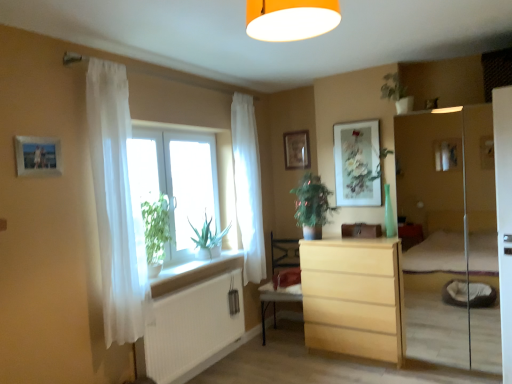
What do you see at coordinates (357, 163) in the screenshot? I see `matte floral artwork at upper center, which is counted as the first picture frame, starting from the right` at bounding box center [357, 163].

Locate an element on the screen. light wood chest of drawers at center is located at coordinates (353, 297).

Measure the distance between point [184,283] and camera.

A distance of 3.34 meters exists between point [184,283] and camera.

In order to click on green leafy plant at center in this screenshot , I will do pyautogui.click(x=312, y=206).

What do you see at coordinates (248, 186) in the screenshot? I see `white sheer curtain at window, which is the second curtain in left-to-right order` at bounding box center [248, 186].

This screenshot has width=512, height=384. Find the location of `matte floral artwork at upper center, which is counted as the first picture frame, starting from the right`. matte floral artwork at upper center, which is counted as the first picture frame, starting from the right is located at coordinates (357, 163).

In the scene shown: Would you consider wooden armchair at center to be distant from white sheer curtain at window, positioned as the first curtain in right-to-left order?

No, wooden armchair at center is not far from white sheer curtain at window, positioned as the first curtain in right-to-left order.

Is wooden armchair at center thinner than white sheer curtain at window, which is the first curtain in back-to-front order?

No, wooden armchair at center is not thinner than white sheer curtain at window, which is the first curtain in back-to-front order.

How different are the orientations of wooden armchair at center and white sheer curtain at window, positioned as the first curtain in right-to-left order, in degrees?

They differ by 74.2 degrees in their facing directions.

Considering the sizes of wooden armchair at center and white sheer curtain at window, positioned as the first curtain in right-to-left order, in the image, is wooden armchair at center taller or shorter than white sheer curtain at window, positioned as the first curtain in right-to-left order,?

In the image, wooden armchair at center appears to be shorter than white sheer curtain at window, positioned as the first curtain in right-to-left order.

Which of these two, matte floral artwork at upper center, the 2th picture frame viewed from the front, or white sheer curtain at window, acting as the 2th curtain starting from the front, is bigger?

Bigger between the two is white sheer curtain at window, acting as the 2th curtain starting from the front.

Which is behind, point (359, 149) or point (244, 130)?

Point (244, 130)

Which is in front, matte floral artwork at upper center, which is counted as the 2th picture frame, starting from the back, or white sheer curtain at window, acting as the 2th curtain starting from the front?

white sheer curtain at window, acting as the 2th curtain starting from the front.

Between matte floral artwork at upper center, which is counted as the 2th picture frame, starting from the back, and white sheer curtain at window, acting as the 2th curtain starting from the front, which one has less height?

With less height is matte floral artwork at upper center, which is counted as the 2th picture frame, starting from the back.

Is white sheer curtain at left, which appears as the 1th curtain when viewed from the left, thinner than light wood chest of drawers at center?

Yes, white sheer curtain at left, which appears as the 1th curtain when viewed from the left, is thinner than light wood chest of drawers at center.

From a real-world perspective, is white sheer curtain at left, the 2th curtain when ordered from back to front, under light wood chest of drawers at center?

Actually, white sheer curtain at left, the 2th curtain when ordered from back to front, is physically above light wood chest of drawers at center in the real world.

You are a GUI agent. You are given a task and a screenshot of the screen. Output one action in this format:
    pyautogui.click(x=<x>, y=<y>)
    Task: Click on the 2nd curtain positioned above the light wood chest of drawers at center (from a real-world perspective)
    
    Given the screenshot: What is the action you would take?
    pyautogui.click(x=116, y=205)

Is white sheer curtain at left, which is the second curtain from right to left, far from light wood chest of drawers at center?

That's right, there is a large distance between white sheer curtain at left, which is the second curtain from right to left, and light wood chest of drawers at center.

From a real-world perspective, is green matte plant at upper center above or below white ribbed radiator at lower left?

Clearly, from a real-world perspective, green matte plant at upper center is above white ribbed radiator at lower left.

At what (x,y) coordinates should I click in order to perform the action: click on plant above the white ribbed radiator at lower left (from a real-world perspective). Please return your answer as a coordinate pair (x, y). Image resolution: width=512 pixels, height=384 pixels. Looking at the image, I should click on (392, 87).

Which object is further away from the camera taking this photo, green matte plant at upper center or white ribbed radiator at lower left?

green matte plant at upper center is further from the camera.

Considering the relative positions of green matte plant at upper center and white ribbed radiator at lower left in the image provided, is green matte plant at upper center to the right of white ribbed radiator at lower left from the viewer's perspective?

Yes, green matte plant at upper center is to the right of white ribbed radiator at lower left.

From a real-world perspective, is matte floral artwork at upper center, which is counted as the 2th picture frame, starting from the back, on wooden photo frame at upper left, which appears as the third picture frame when viewed from the right?

No, from a real-world perspective, matte floral artwork at upper center, which is counted as the 2th picture frame, starting from the back, is not over wooden photo frame at upper left, which appears as the third picture frame when viewed from the right

In terms of height, does matte floral artwork at upper center, which is counted as the first picture frame, starting from the right, look taller or shorter compared to wooden photo frame at upper left, which ranks as the 1th picture frame in left-to-right order?

In the image, matte floral artwork at upper center, which is counted as the first picture frame, starting from the right, appears to be taller than wooden photo frame at upper left, which ranks as the 1th picture frame in left-to-right order.

Is matte floral artwork at upper center, the 3th picture frame when ordered from left to right, positioned far away from wooden photo frame at upper left, the third picture frame in the back-to-front sequence?

Absolutely, matte floral artwork at upper center, the 3th picture frame when ordered from left to right, is distant from wooden photo frame at upper left, the third picture frame in the back-to-front sequence.

I want to click on houseplant that is in front of the matte wooden picture frame at upper center, which ranks as the second picture frame in left-to-right order, so click(312, 206).

From the image's perspective, which is below, matte wooden picture frame at upper center, the first picture frame positioned from the back, or green leafy plant at center?

green leafy plant at center appears lower in the image.

Looking at this image, is matte wooden picture frame at upper center, which is the 2th picture frame in right-to-left order, turned away from green leafy plant at center?

That's not correct — matte wooden picture frame at upper center, which is the 2th picture frame in right-to-left order, is not looking away from green leafy plant at center.

Is matte wooden picture frame at upper center, which ranks as the second picture frame in left-to-right order, taller than green leafy plant at center?

In fact, matte wooden picture frame at upper center, which ranks as the second picture frame in left-to-right order, may be shorter than green leafy plant at center.

Which is more to the left, transparent glass window at center or wooden armchair at center?

Positioned to the left is transparent glass window at center.

From a real-world perspective, between transparent glass window at center and wooden armchair at center, who is vertically higher?

transparent glass window at center.

From the image's perspective, which one is positioned lower, transparent glass window at center or wooden armchair at center?

wooden armchair at center, from the image's perspective.

How different are the orientations of transparent glass window at center and wooden armchair at center in degrees?

They differ by 74.7 degrees in their facing directions.

The height and width of the screenshot is (384, 512). I want to click on the 1st curtain counting from the left side of the wooden armchair at center, so click(248, 186).

Identify the location of the 2nd picture frame counting from the right of the white sheer curtain at window, acting as the 2th curtain starting from the front. (357, 163).

From the image, which object appears to be nearer to white ribbed radiator at lower left, orange matte/soft light fixture at upper center or white sheer curtain at window, which is the first curtain in back-to-front order?

white sheer curtain at window, which is the first curtain in back-to-front order, is closer to white ribbed radiator at lower left.

Which object lies further to the anchor point wooden at left, matte floral artwork at upper center, which is counted as the 2th picture frame, starting from the back, or orange matte/soft light fixture at upper center?

Among the two, orange matte/soft light fixture at upper center is located further to wooden at left.

From the picture: Estimate the real-world distances between objects in this image. Which object is further from wooden armchair at center, green leafy plant at center or green matte plant at upper center?

The object further to wooden armchair at center is green matte plant at upper center.

Based on their spatial positions, is transparent glass window at center or green leafy plant at center closer to orange matte/soft light fixture at upper center?

Among the two, transparent glass window at center is located nearer to orange matte/soft light fixture at upper center.

Estimate the real-world distances between objects in this image. Which object is further from transparent glass window at center, white ribbed radiator at lower left or white sheer curtain at window, positioned as the first curtain in right-to-left order?

white ribbed radiator at lower left lies further to transparent glass window at center than the other object.

Which object lies further to the anchor point wooden armchair at center, green matte plant at upper center or light wood chest of drawers at center?

green matte plant at upper center.

Based on their spatial positions, is wooden at left or orange matte/soft light fixture at upper center further from white sheer curtain at window, acting as the 2th curtain starting from the front?

orange matte/soft light fixture at upper center is positioned further to the anchor white sheer curtain at window, acting as the 2th curtain starting from the front.

Based on their spatial positions, is white ribbed radiator at lower left or transparent glass window at center closer to matte floral artwork at upper center, the 2th picture frame viewed from the front?

Based on the image, transparent glass window at center appears to be nearer to matte floral artwork at upper center, the 2th picture frame viewed from the front.

Where is `radiator between orange matte/soft light fixture at upper center and wooden armchair at center in the front-back direction`? radiator between orange matte/soft light fixture at upper center and wooden armchair at center in the front-back direction is located at coordinates (192, 326).

This screenshot has width=512, height=384. I want to click on picture frame between orange matte/soft light fixture at upper center and transparent glass window at center along the z-axis, so click(38, 156).

In order to click on chest of drawers between white sheer curtain at left, which is the second curtain from right to left, and matte floral artwork at upper center, the 3th picture frame when ordered from left to right in this screenshot , I will do `click(353, 297)`.

At what (x,y) coordinates should I click in order to perform the action: click on radiator between wooden photo frame at upper left, the first picture frame positioned from the front, and white sheer curtain at window, positioned as the first curtain in right-to-left order, in the front-back direction. Please return your answer as a coordinate pair (x, y). Image resolution: width=512 pixels, height=384 pixels. Looking at the image, I should click on (192, 326).